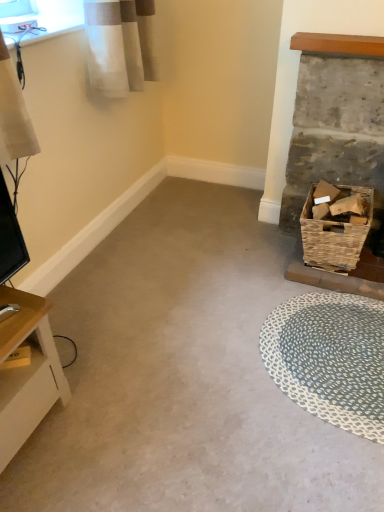
Question: Is rustic wicker basket at right inside woven brown basket at right?

Choices:
 (A) yes
 (B) no

Answer: (B)

Question: Does woven brown basket at right have a larger size compared to rustic wicker basket at right?

Choices:
 (A) yes
 (B) no

Answer: (B)

Question: From the image's perspective, is woven brown basket at right above rustic wicker basket at right?

Choices:
 (A) no
 (B) yes

Answer: (A)

Question: From a real-world perspective, is woven brown basket at right on rustic wicker basket at right?

Choices:
 (A) no
 (B) yes

Answer: (A)

Question: Does woven brown basket at right come behind rustic wicker basket at right?

Choices:
 (A) yes
 (B) no

Answer: (A)

Question: Choose the correct answer: Is light wood table at lower left inside blue woven mat at lower right or outside it?

Choices:
 (A) inside
 (B) outside

Answer: (B)

Question: From the image's perspective, is light wood table at lower left located above or below blue woven mat at lower right?

Choices:
 (A) below
 (B) above

Answer: (A)

Question: Considering the positions of light wood table at lower left and blue woven mat at lower right in the image, is light wood table at lower left taller or shorter than blue woven mat at lower right?

Choices:
 (A) tall
 (B) short

Answer: (A)

Question: Considering the positions of light wood table at lower left and blue woven mat at lower right in the image, is light wood table at lower left wider or thinner than blue woven mat at lower right?

Choices:
 (A) wide
 (B) thin

Answer: (B)

Question: Is rustic wicker basket at right wider or thinner than blue woven mat at lower right?

Choices:
 (A) wide
 (B) thin

Answer: (B)

Question: Is rustic wicker basket at right in front of or behind blue woven mat at lower right in the image?

Choices:
 (A) front
 (B) behind

Answer: (B)

Question: Choose the correct answer: Is rustic wicker basket at right inside blue woven mat at lower right or outside it?

Choices:
 (A) inside
 (B) outside

Answer: (B)

Question: Is rustic wicker basket at right bigger or smaller than blue woven mat at lower right?

Choices:
 (A) small
 (B) big

Answer: (B)

Question: Considering the positions of woven brown basket at right and light wood table at lower left in the image, is woven brown basket at right bigger or smaller than light wood table at lower left?

Choices:
 (A) small
 (B) big

Answer: (A)

Question: Is woven brown basket at right in front of or behind light wood table at lower left in the image?

Choices:
 (A) front
 (B) behind

Answer: (B)